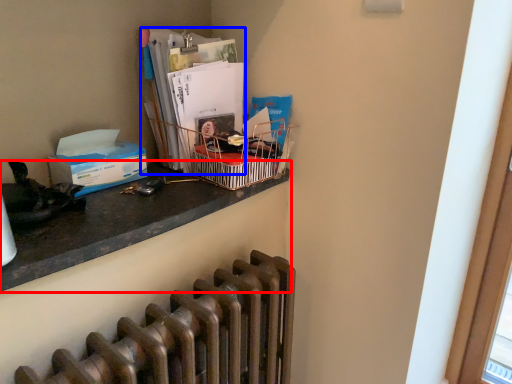
Question: Which object appears farthest to the camera in this image, desk (highlighted by a red box) or magazine (highlighted by a blue box)?

Choices:
 (A) desk
 (B) magazine

Answer: (B)